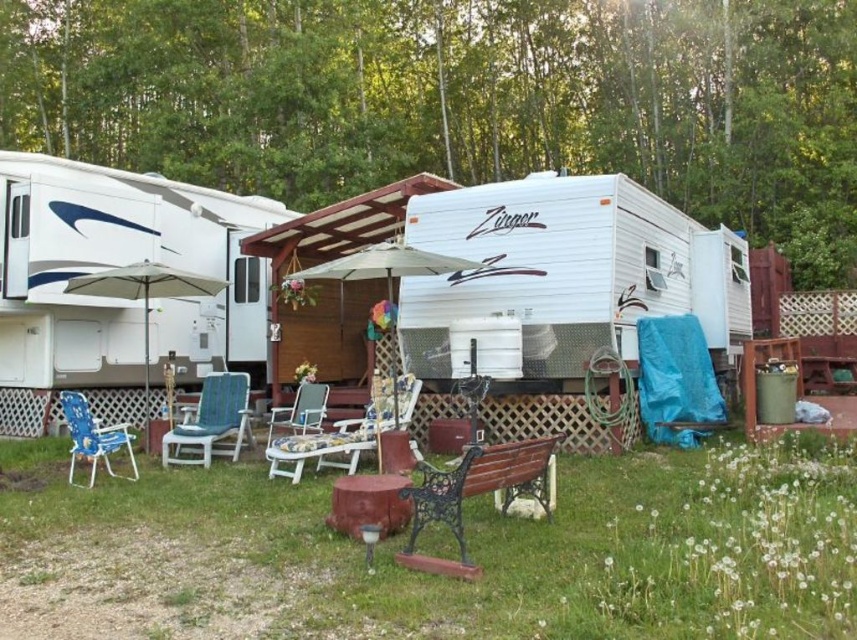
You are a camper setting up your tent in the wooded area. You want to place your tent in a spot that is shaded by the blue plastic chair at lower left. Is the wooden bench at center in the way of this shaded area?

The wooden bench at center is positioned under the blue plastic chair at lower left, so the bench is blocking the shaded area created by the chair. Therefore, the bench is in the way of the shaded area provided by the blue plastic chair at lower left.

You are setting up a picnic area between the blue fabric chair at center and the blue plastic chair at lower left. Which chair has a wider seat to accommodate more people?

The blue fabric chair at center has a wider seat than the blue plastic chair at lower left, so it can accommodate more people.